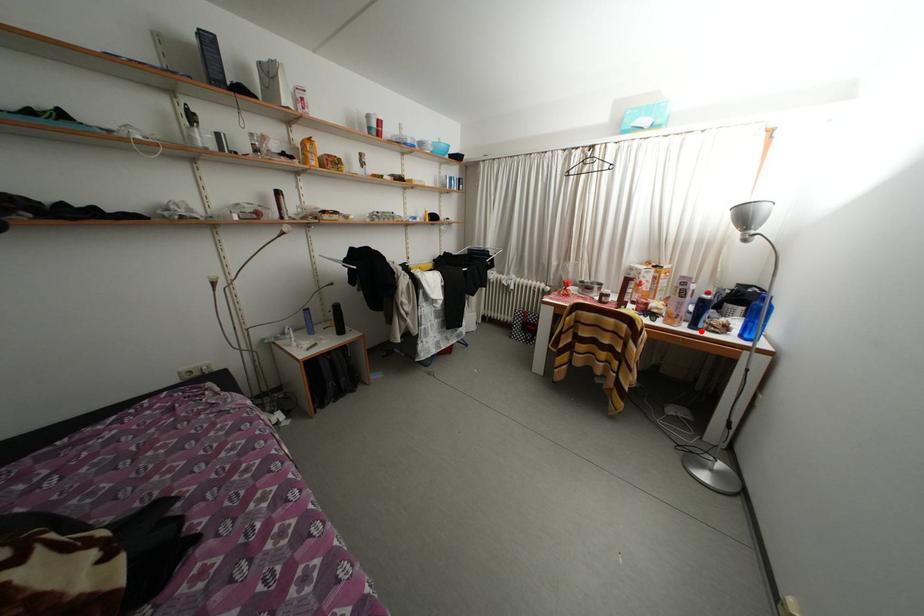
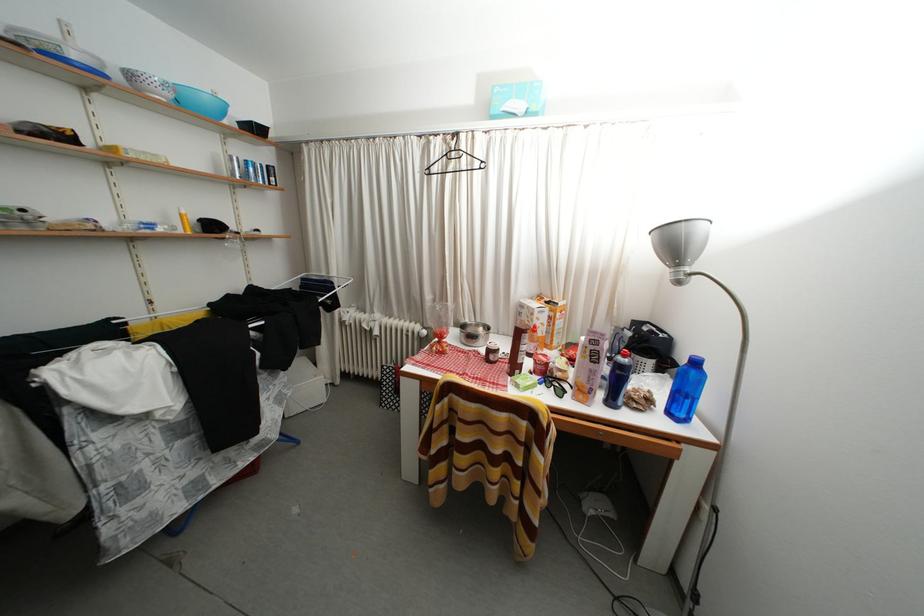
Find the pixel in the second image that matches the highlighted location in the first image.

(618, 408)